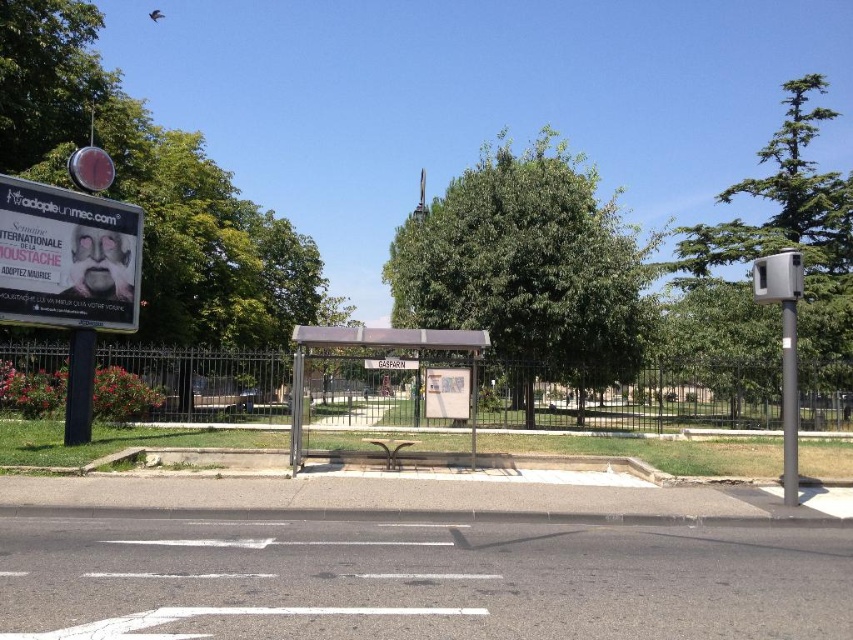
Is black metal fence at center above white plastic sign at center?

Incorrect, black metal fence at center is not positioned above white plastic sign at center.

What do you see at coordinates (636, 396) in the screenshot?
I see `black metal fence at center` at bounding box center [636, 396].

Where is `black metal fence at center`? This screenshot has height=640, width=853. black metal fence at center is located at coordinates (636, 396).

Is green leafy tree at upper center to the left of white plastic street sign at center from the viewer's perspective?

Yes, green leafy tree at upper center is to the left of white plastic street sign at center.

Is point (196, 228) positioned in front of point (393, 358)?

No, it is behind (393, 358).

Where is `green leafy tree at upper center`? green leafy tree at upper center is located at coordinates (154, 189).

The width and height of the screenshot is (853, 640). What do you see at coordinates (527, 266) in the screenshot? I see `green leafy tree at center` at bounding box center [527, 266].

Can you confirm if green leafy tree at center is positioned below green leafy tree at right?

Yes, green leafy tree at center is below green leafy tree at right.

Who is more distant from viewer, [613,248] or [741,188]?

The point [741,188] is behind.

Find the location of `green leafy tree at center`. green leafy tree at center is located at coordinates (527, 266).